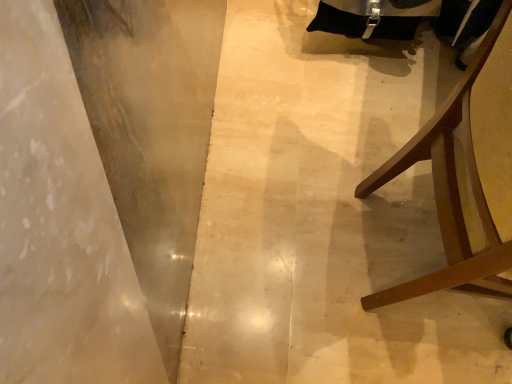
Question: Is smooth concrete at left in front of or behind brown wood chair at right in the image?

Choices:
 (A) front
 (B) behind

Answer: (B)

Question: From their relative heights in the image, would you say smooth concrete at left is taller or shorter than brown wood chair at right?

Choices:
 (A) tall
 (B) short

Answer: (B)

Question: In terms of width, does smooth concrete at left look wider or thinner when compared to brown wood chair at right?

Choices:
 (A) thin
 (B) wide

Answer: (B)

Question: Looking at their shapes, would you say brown wood chair at right is wider or thinner than smooth concrete at left?

Choices:
 (A) thin
 (B) wide

Answer: (A)

Question: Choose the correct answer: Is brown wood chair at right inside smooth concrete at left or outside it?

Choices:
 (A) outside
 (B) inside

Answer: (A)

Question: Considering the positions of brown wood chair at right and smooth concrete at left in the image, is brown wood chair at right bigger or smaller than smooth concrete at left?

Choices:
 (A) big
 (B) small

Answer: (A)

Question: Considering the positions of point (499, 31) and point (256, 281), is point (499, 31) closer or farther from the camera than point (256, 281)?

Choices:
 (A) farther
 (B) closer

Answer: (B)